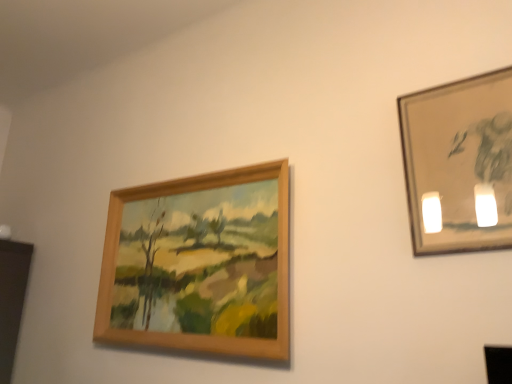
Question: Is metallic silver frame at upper right, marked as the first picture frame in a front-to-back arrangement, in front of or behind wooden frame at upper left, which is the first picture frame in left-to-right order, in the image?

Choices:
 (A) front
 (B) behind

Answer: (A)

Question: Considering the positions of metallic silver frame at upper right, marked as the first picture frame in a front-to-back arrangement, and wooden frame at upper left, the 2th picture frame positioned from the front, in the image, is metallic silver frame at upper right, marked as the first picture frame in a front-to-back arrangement, bigger or smaller than wooden frame at upper left, the 2th picture frame positioned from the front,?

Choices:
 (A) big
 (B) small

Answer: (B)

Question: Is metallic silver frame at upper right, the 1th picture frame when ordered from right to left, situated inside wooden frame at upper left, the first picture frame from the back, or outside?

Choices:
 (A) inside
 (B) outside

Answer: (B)

Question: Is wooden frame at upper left, the 2th picture frame positioned from the front, wider or thinner than metallic silver frame at upper right, the 2th picture frame viewed from the back?

Choices:
 (A) wide
 (B) thin

Answer: (A)

Question: Looking at the image, does wooden frame at upper left, the 2th picture frame positioned from the front, seem bigger or smaller compared to metallic silver frame at upper right, the 1th picture frame when ordered from right to left?

Choices:
 (A) big
 (B) small

Answer: (A)

Question: From a real-world perspective, is wooden frame at upper left, arranged as the 2th picture frame when viewed from the right, physically located above or below metallic silver frame at upper right, the 1th picture frame when ordered from right to left?

Choices:
 (A) above
 (B) below

Answer: (B)

Question: In terms of height, does wooden frame at upper left, arranged as the 2th picture frame when viewed from the right, look taller or shorter compared to metallic silver frame at upper right, the second picture frame from the left?

Choices:
 (A) tall
 (B) short

Answer: (A)